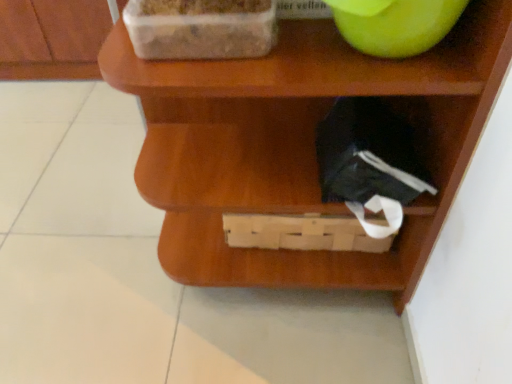
Where is `blank space to the left of wooden basket at lower center`? Image resolution: width=512 pixels, height=384 pixels. blank space to the left of wooden basket at lower center is located at coordinates (99, 273).